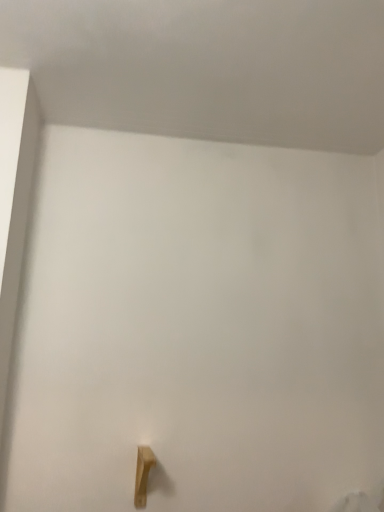
Image resolution: width=384 pixels, height=512 pixels. Describe the element at coordinates (143, 474) in the screenshot. I see `wooden door handle at lower center` at that location.

The image size is (384, 512). Identify the location of wooden door handle at lower center. click(143, 474).

Where is `wooden door handle at lower center`? The image size is (384, 512). wooden door handle at lower center is located at coordinates (143, 474).